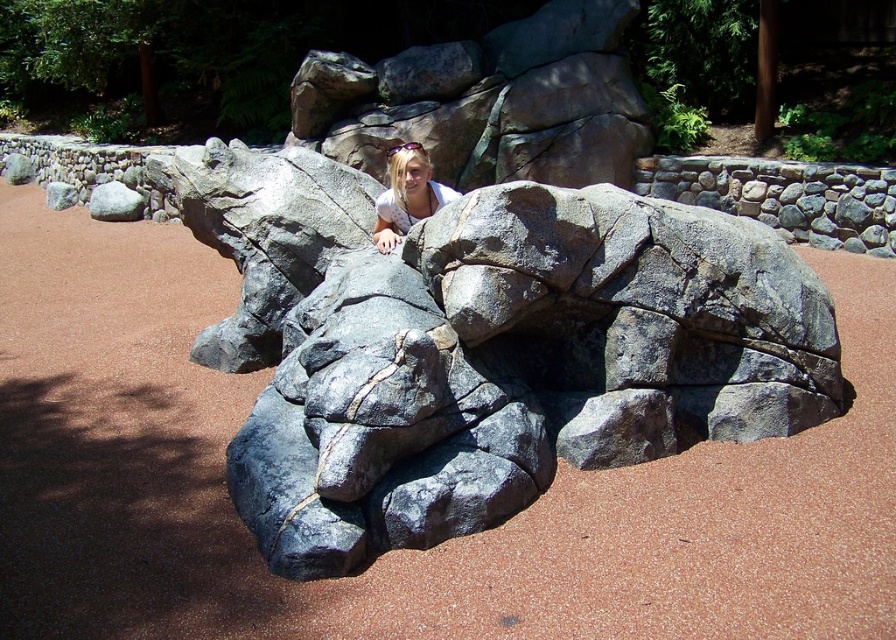
You are standing in front of the gray rough rock at center and want to see the blonde hair at center through the cave opening. Can you see it clearly from your current position?

The gray rough rock at center is closer to the viewer than the blonde hair at center, so yes, you can see the blonde hair at center clearly through the cave opening because the rock isn

You are planning to install a safety net between the gray rough rock at center and the gray rough rock at upper left. The net requires a minimum of 20 feet of space between the two rocks to be effective. Based on the scene, will the safety net work properly?

The distance between the gray rough rock at center and the gray rough rock at upper left is 22.85 feet, which exceeds the minimum requirement of 20 feet. Therefore, the safety net will work properly between them.